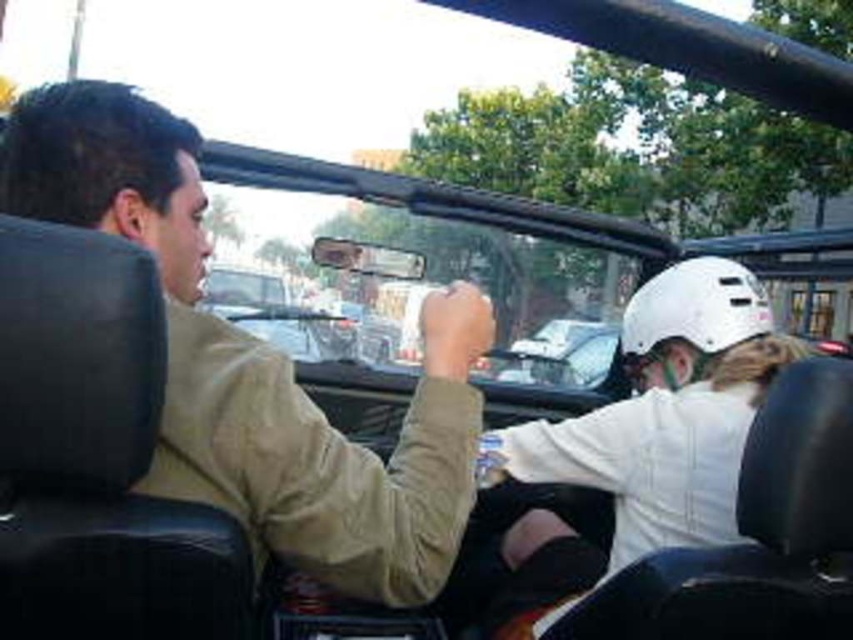
You are a passenger in a convertible and want to place your phone on the khakimaterial at left. Can you estimate where to place it based on the coordinates provided?

The khakimaterial at left is located at coordinates point (325, 452), so place your phone there.

You are sitting in the convertible vehicle and want to reach both the point at coordinates (x=444, y=496) and the point at (x=657, y=372). Which point will you reach first if you extend your hand forward?

The point at coordinates (x=444, y=496) is closer to the viewer than the point at (x=657, y=372), so you will reach the point at (x=444, y=496) first.

You are a photographer trying to capture a candid shot of the khaki cotton shirt at center without the camera being visible in the frame. Given their current positions, is the camera positioned in a way that allows this?

The khaki cotton shirt at center and camera are 35.97 inches apart. Since the camera is positioned 35.97 inches away from the khaki cotton shirt at center, it is likely positioned in a way that allows capturing the shot without being visible in the frame.